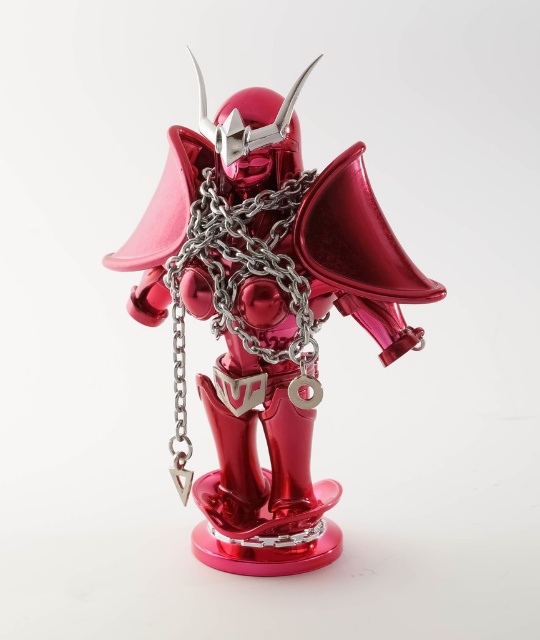
Between metallic red armor at center and metallic silver chain at center, which one has less height?

Standing shorter between the two is metallic silver chain at center.

Is metallic red armor at center above metallic silver chain at center?

Incorrect, metallic red armor at center is not positioned above metallic silver chain at center.

Identify the location of metallic red armor at center. (266, 310).